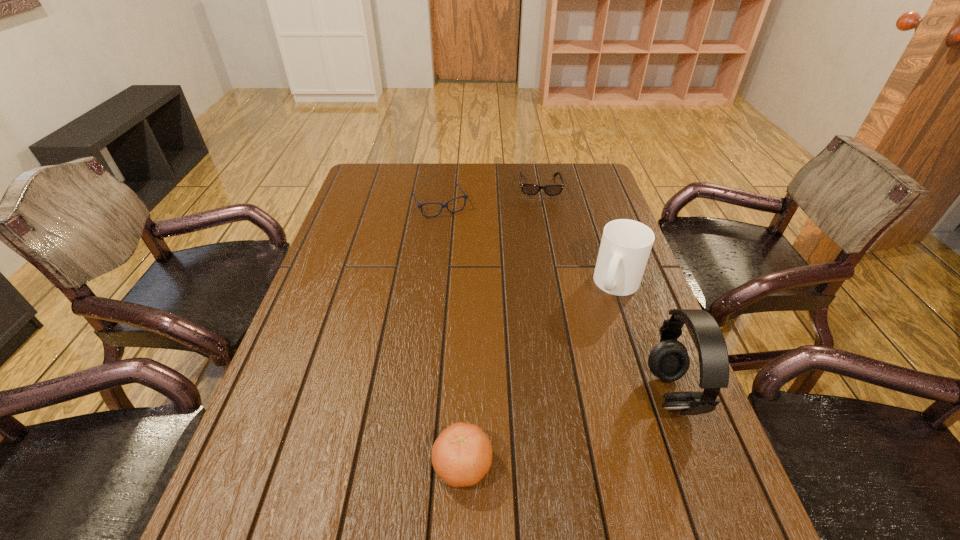
The image size is (960, 540). I want to click on free spot on the desktop that is between the third shortest object and the earphone and is positioned on the handle side of the third nearest object, so (583, 425).

Locate an element on the screen. This screenshot has height=540, width=960. vacant space on the desktop that is between the third tallest object and the tallest object and is positioned on the lenses of the third object from right to left is located at coordinates (567, 430).

At what (x,y) coordinates should I click in order to perform the action: click on free space on the desktop that is between the third shortest object and the tallest object and is positioned on the front-facing side of the left spectacles. Please return your answer as a coordinate pair (x, y). Looking at the image, I should click on (567, 430).